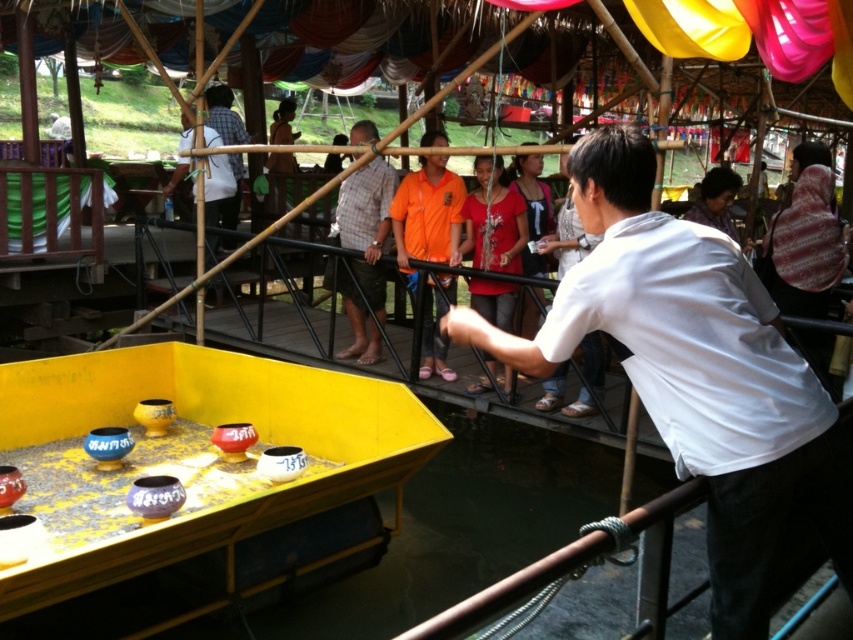
In the scene shown: You are organizing a community event and need to decide which orange garment to use for the main performer. The orange jersey at center and the orange fabric shirt at center are both available. Based on their sizes, which one would be more suitable for a performance requiring visibility from a distance?

The orange jersey at center is larger in size compared to the orange fabric shirt at center, making it more suitable for visibility from a distance during the performance.

You are organizing a community event and need to decide which clothing item to use for a demonstration. The white matte shirt at center and orange jersey at center are both available. Which one should you choose if you want the clothing item to be more visible from a distance?

The white matte shirt at center is bigger than the orange jersey at center, so it would be more visible from a distance.

You are standing at the wooden platform surrounded by bamboo scaffolding and want to place a new decorative item at the exact center of the image. Considering the yellow matte boat at center is already there, where should you place the new item relative to the boat?

The yellow matte boat at center is already located at the exact center of the image at point coordinates (194, 465), so the new decorative item should be placed at the same location as the yellow matte boat at center to be at the center.